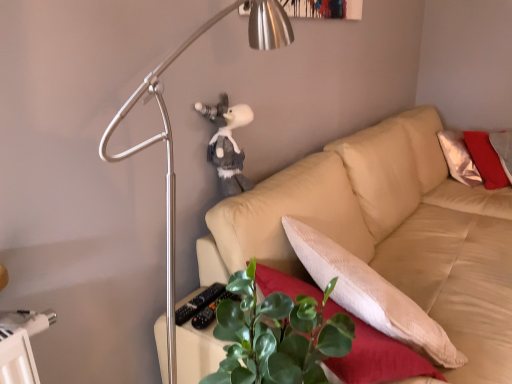
What do you see at coordinates (227, 144) in the screenshot? I see `white plush toy at upper center` at bounding box center [227, 144].

What do you see at coordinates (277, 335) in the screenshot? This screenshot has height=384, width=512. I see `green leafy plant at lower center` at bounding box center [277, 335].

This screenshot has width=512, height=384. What do you see at coordinates (170, 130) in the screenshot?
I see `metallic silver lamp at upper left` at bounding box center [170, 130].

This screenshot has height=384, width=512. I want to click on beige fabric couch at center, so click(x=389, y=231).

Who is taller, beige fabric couch at center or white plush toy at upper center?

beige fabric couch at center.

Is beige fabric couch at center wider than white plush toy at upper center?

Yes, beige fabric couch at center is wider than white plush toy at upper center.

Does beige fabric couch at center turn towards white plush toy at upper center?

No, beige fabric couch at center does not turn towards white plush toy at upper center.

From the picture: Would you consider green leafy plant at lower center to be distant from beige fabric couch at center?

No, green leafy plant at lower center is in close proximity to beige fabric couch at center.

Is green leafy plant at lower center to the left of beige fabric couch at center from the viewer's perspective?

Indeed, green leafy plant at lower center is positioned on the left side of beige fabric couch at center.

From a real-world perspective, is green leafy plant at lower center located beneath beige fabric couch at center?

No, from a real-world perspective, green leafy plant at lower center is not below beige fabric couch at center.

Who is more distant, green leafy plant at lower center or beige fabric couch at center?

beige fabric couch at center is further from the camera.

From the picture: Does metallic silver lamp at upper left appear on the right side of beige fabric couch at center?

Incorrect, metallic silver lamp at upper left is not on the right side of beige fabric couch at center.

You are a GUI agent. You are given a task and a screenshot of the screen. Output one action in this format:
    pyautogui.click(x=<x>, y=<y>)
    Task: Click on the studio couch that appears on the right of metallic silver lamp at upper left
    
    Given the screenshot: What is the action you would take?
    pyautogui.click(x=389, y=231)

Considering the relative sizes of metallic silver lamp at upper left and beige fabric couch at center in the image provided, is metallic silver lamp at upper left shorter than beige fabric couch at center?

No, metallic silver lamp at upper left is not shorter than beige fabric couch at center.

Which object is thinner, metallic silver lamp at upper left or beige fabric couch at center?

With smaller width is metallic silver lamp at upper left.

In the image, is beige fabric couch at center on the left side or the right side of green leafy plant at lower center?

beige fabric couch at center is positioned on green leafy plant at lower center's right side.

From the image's perspective, would you say beige fabric couch at center is positioned over green leafy plant at lower center?

Indeed, from the image's perspective, beige fabric couch at center is shown above green leafy plant at lower center.

From a real-world perspective, does beige fabric couch at center stand above green leafy plant at lower center?

Incorrect, from a real-world perspective, beige fabric couch at center is lower than green leafy plant at lower center.

Who is shorter, beige fabric couch at center or green leafy plant at lower center?

With less height is green leafy plant at lower center.

How distant is white plush toy at upper center from metallic silver lamp at upper left?

white plush toy at upper center is 13.15 inches away from metallic silver lamp at upper left.

From the image's perspective, which one is positioned higher, white plush toy at upper center or metallic silver lamp at upper left?

white plush toy at upper center, from the image's perspective.

Is white plush toy at upper center placed right next to metallic silver lamp at upper left?

No, white plush toy at upper center is not touching metallic silver lamp at upper left.

From the picture: Considering the relative positions of white plush toy at upper center and beige fabric couch at center in the image provided, is white plush toy at upper center to the left of beige fabric couch at center from the viewer's perspective?

Indeed, white plush toy at upper center is positioned on the left side of beige fabric couch at center.

Is white plush toy at upper center smaller than beige fabric couch at center?

Yes.

What's the angular difference between white plush toy at upper center and beige fabric couch at center's facing directions?

The angle between the facing direction of white plush toy at upper center and the facing direction of beige fabric couch at center is 0.373 degrees.

From a real-world perspective, is white plush toy at upper center on top of beige fabric couch at center?

Yes, from a real-world perspective, white plush toy at upper center is above beige fabric couch at center.

Is point (481, 209) more distant than point (177, 51)?

That is True.

From the picture: Considering the relative positions of beige fabric couch at center and metallic silver lamp at upper left in the image provided, is beige fabric couch at center to the left of metallic silver lamp at upper left from the viewer's perspective?

In fact, beige fabric couch at center is to the right of metallic silver lamp at upper left.

Is beige fabric couch at center in front of or behind metallic silver lamp at upper left in the image?

In the image, beige fabric couch at center appears behind metallic silver lamp at upper left.

Is beige fabric couch at center spatially inside metallic silver lamp at upper left, or outside of it?

beige fabric couch at center is not enclosed by metallic silver lamp at upper left.

Image resolution: width=512 pixels, height=384 pixels. Find the location of `studio couch in front of the white plush toy at upper center`. studio couch in front of the white plush toy at upper center is located at coordinates (389, 231).

This screenshot has width=512, height=384. Identify the location of plant located below the beige fabric couch at center (from the image's perspective). (x=277, y=335).

When comparing their distances from metallic silver lamp at upper left, does beige fabric couch at center or green leafy plant at lower center seem further?

Based on the image, beige fabric couch at center appears to be further to metallic silver lamp at upper left.

Estimate the real-world distances between objects in this image. Which object is closer to green leafy plant at lower center, beige fabric couch at center or white plush toy at upper center?

The object closer to green leafy plant at lower center is white plush toy at upper center.

From the image, which object appears to be farther from metallic silver lamp at upper left, green leafy plant at lower center or white plush toy at upper center?

The object further to metallic silver lamp at upper left is green leafy plant at lower center.

Which object lies nearer to the anchor point metallic silver lamp at upper left, beige fabric couch at center or white plush toy at upper center?

white plush toy at upper center is closer to metallic silver lamp at upper left.

Considering their positions, is metallic silver lamp at upper left positioned closer to green leafy plant at lower center than white plush toy at upper center?

metallic silver lamp at upper left is closer to green leafy plant at lower center.

Estimate the real-world distances between objects in this image. Which object is closer to metallic silver lamp at upper left, white plush toy at upper center or beige fabric couch at center?

Based on the image, white plush toy at upper center appears to be nearer to metallic silver lamp at upper left.

Looking at the image, which one is located closer to green leafy plant at lower center, white plush toy at upper center or metallic silver lamp at upper left?

metallic silver lamp at upper left.

When comparing their distances from white plush toy at upper center, does beige fabric couch at center or green leafy plant at lower center seem further?

green leafy plant at lower center lies further to white plush toy at upper center than the other object.

What are the coordinates of `lamp between white plush toy at upper center and beige fabric couch at center` in the screenshot? It's located at pos(170,130).

Where is `plant located between metallic silver lamp at upper left and beige fabric couch at center in the left-right direction`? This screenshot has height=384, width=512. plant located between metallic silver lamp at upper left and beige fabric couch at center in the left-right direction is located at coordinates (277, 335).

I want to click on plant positioned between metallic silver lamp at upper left and white plush toy at upper center from near to far, so click(x=277, y=335).

The width and height of the screenshot is (512, 384). I want to click on plant between white plush toy at upper center and beige fabric couch at center from left to right, so click(277, 335).